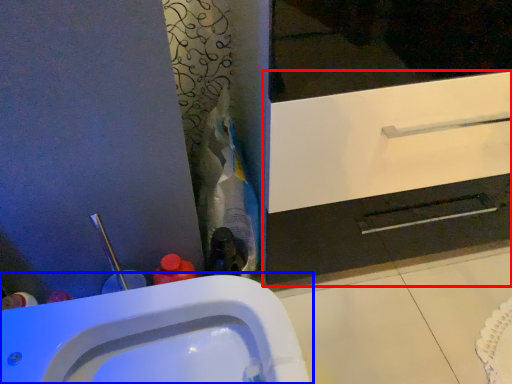
Question: Among these objects, which one is farthest to the camera, bathroom cabinet (highlighted by a red box) or sink (highlighted by a blue box)?

Choices:
 (A) bathroom cabinet
 (B) sink

Answer: (A)